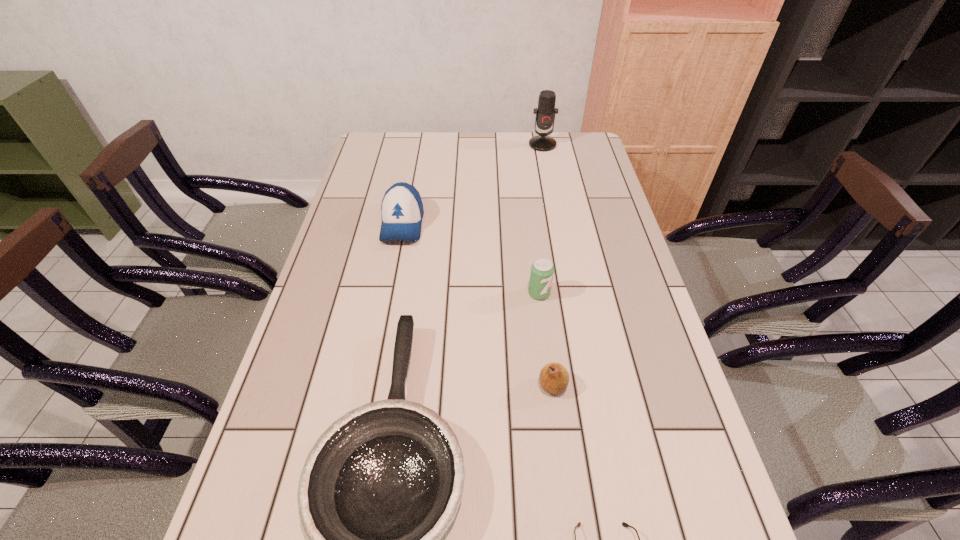
Find the location of a particular element. This screenshot has height=540, width=960. object that is at the left edge is located at coordinates (402, 210).

I want to click on object present at the right edge, so click(x=545, y=114).

This screenshot has height=540, width=960. I want to click on object that is at the far right corner, so click(545, 114).

Find the location of a particular element. free spot at the far edge of the desktop is located at coordinates [x=432, y=146].

In the image, there is a desktop. Where is `vacant space at the left edge`? vacant space at the left edge is located at coordinates (348, 288).

The width and height of the screenshot is (960, 540). What are the coordinates of `free space at the right edge of the desktop` in the screenshot? It's located at (565, 171).

Find the location of a particular element. This screenshot has width=960, height=540. free space at the far left corner of the desktop is located at coordinates point(405,138).

In order to click on vacant space in between the fourth tallest object and the second farthest object in this screenshot , I will do `click(478, 305)`.

Where is `empty space that is in between the fifth nearest object and the microphone`? This screenshot has height=540, width=960. empty space that is in between the fifth nearest object and the microphone is located at coordinates (472, 184).

I want to click on free space between the soda and the microphone, so click(540, 219).